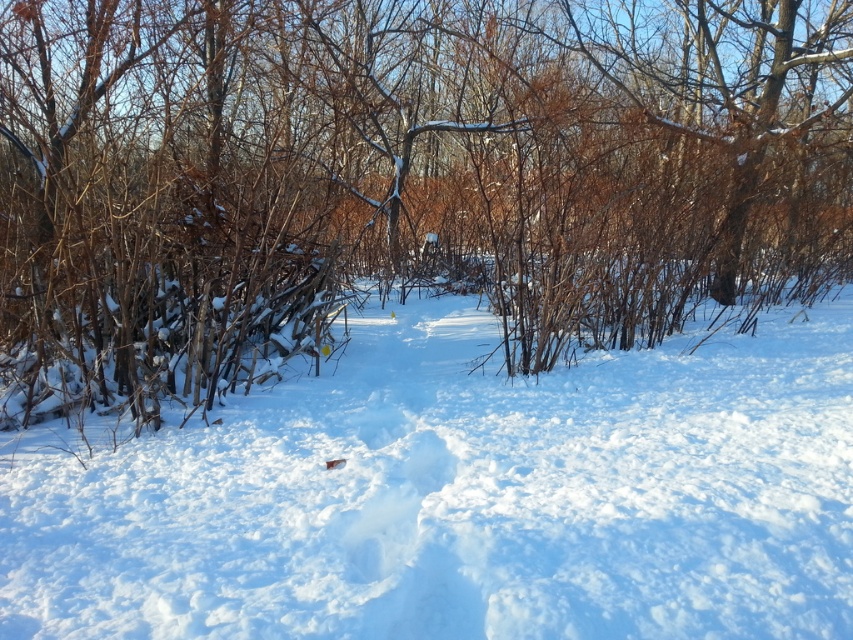
Question: Does brown wood at center appear on the left side of white fluffy snow at center?

Choices:
 (A) no
 (B) yes

Answer: (B)

Question: Does brown wood at center appear on the right side of white fluffy snow at center?

Choices:
 (A) yes
 (B) no

Answer: (B)

Question: Which object is closer to the camera taking this photo?

Choices:
 (A) brown wood at center
 (B) white fluffy snow at center

Answer: (B)

Question: Which point appears closest to the camera in this image?

Choices:
 (A) (54, 369)
 (B) (728, 580)

Answer: (B)

Question: Can you confirm if brown wood at center is bigger than white fluffy snow at center?

Choices:
 (A) yes
 (B) no

Answer: (A)